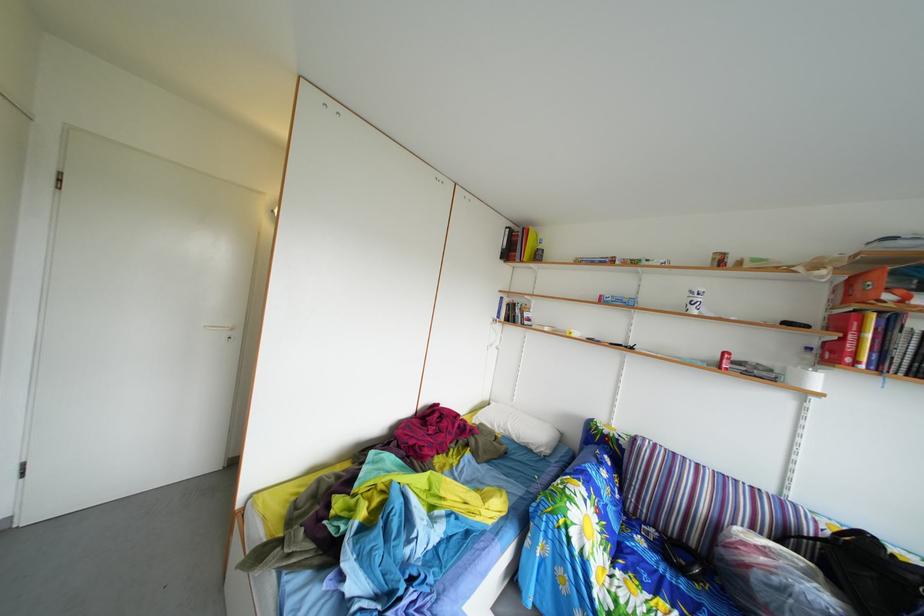
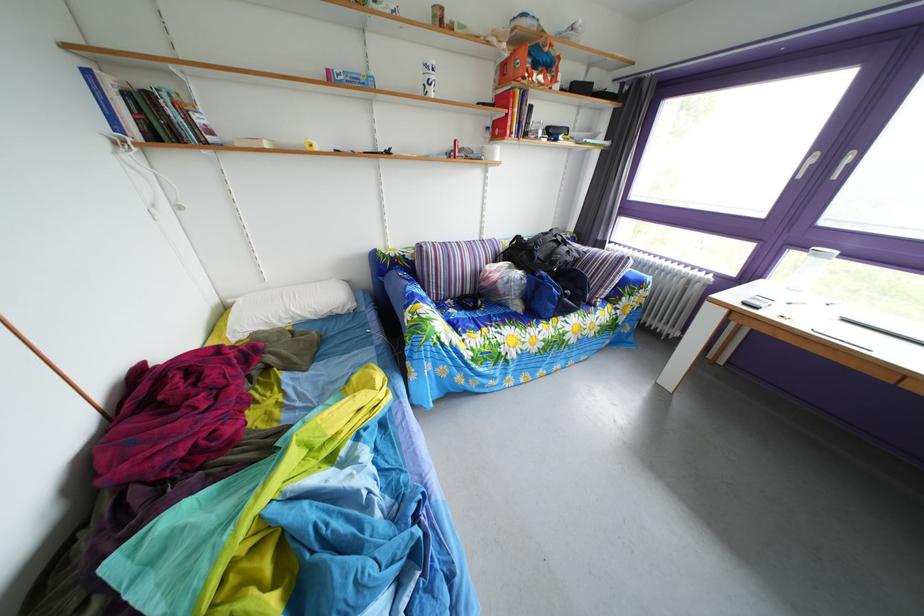
The point at (820, 358) is marked in the first image. Where is the corresponding point in the second image?

(499, 137)